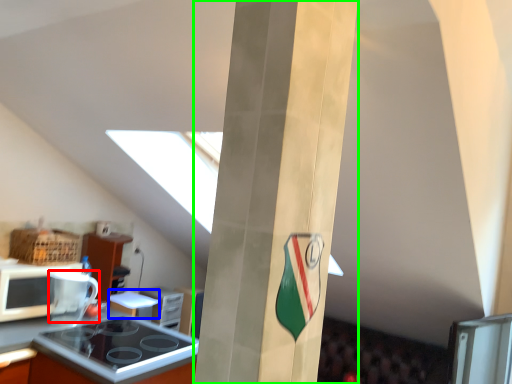
Question: Considering the real-world distances, which object is farthest from appliance (highlighted by a red box)? appliance (highlighted by a blue box) or pillar (highlighted by a green box)?

Choices:
 (A) appliance
 (B) pillar

Answer: (B)